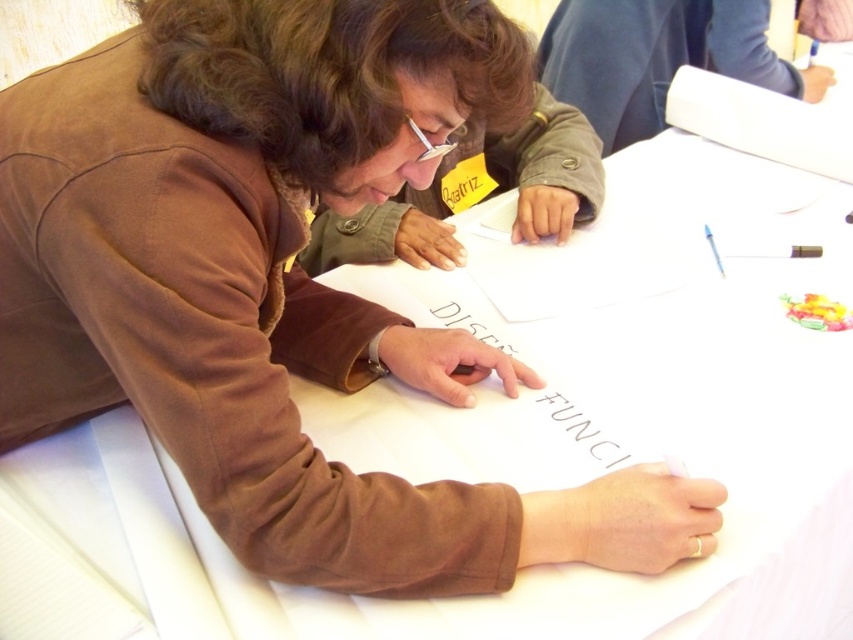
You are an interior designer working on a project. You need to place a new decorative item on the table. The blue fabric at upper center and the white paper at center are already on the table. Which object has more space available around it for placing the new item?

The blue fabric at upper center has a larger size compared to the white paper at center, so there is more space available around it for placing the new item.

You are an interior designer looking at this image of a collaborative design session. You need to determine the spatial relationship between the blue fabric at upper center and the white paper at center. Based on the scene, which object is positioned to the right of the other?

The blue fabric at upper center is positioned to the right of the white paper at center.